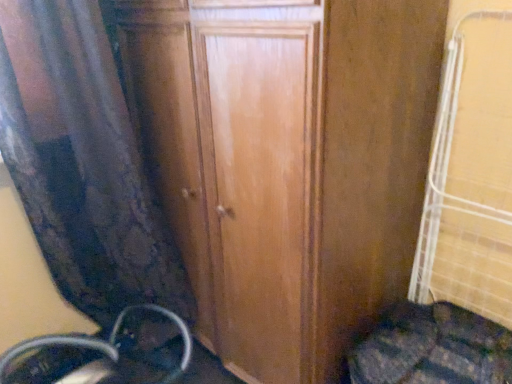
Identify the location of wooden door at center. (287, 162).

Measure the distance between point (426, 158) and camera.

Point (426, 158) and camera are 1.36 meters apart.

Where is `velvet curtain at left`? The height and width of the screenshot is (384, 512). velvet curtain at left is located at coordinates (82, 162).

This screenshot has width=512, height=384. In order to click on wooden door at center in this screenshot , I will do `click(287, 162)`.

Is velvet curtain at left located outside wooden door at center?

Yes.

Can you confirm if velvet curtain at left is smaller than wooden door at center?

Indeed, velvet curtain at left has a smaller size compared to wooden door at center.

Would you say velvet curtain at left is to the left or to the right of wooden door at center in the picture?

Clearly, velvet curtain at left is on the left of wooden door at center in the image.

Is wooden door at center taller than velvet curtain at left?

Correct, wooden door at center is much taller as velvet curtain at left.

Can you tell me how much wooden door at center and velvet curtain at left differ in facing direction?

The angular difference between wooden door at center and velvet curtain at left is 90.1 degrees.

Is wooden door at center next to velvet curtain at left and touching it?

wooden door at center is not next to velvet curtain at left, and they're not touching.

Would you say wooden door at center contains velvet curtain at left?

That's incorrect, velvet curtain at left is not inside wooden door at center.

Is velvet curtain at left in front of or behind metallic silver wheel at lower left in the image?

In the image, velvet curtain at left appears in front of metallic silver wheel at lower left.

From a real-world perspective, who is located higher, velvet curtain at left or metallic silver wheel at lower left?

velvet curtain at left is physically above.

Based on the photo, can you confirm if velvet curtain at left is taller than metallic silver wheel at lower left?

Indeed, velvet curtain at left has a greater height compared to metallic silver wheel at lower left.

Is there a large distance between velvet curtain at left and metallic silver wheel at lower left?

velvet curtain at left is near metallic silver wheel at lower left, not far away.

Identify the location of door on the right side of metallic silver wheel at lower left. This screenshot has height=384, width=512. (287, 162).

Is metallic silver wheel at lower left turned away from wooden door at center?

metallic silver wheel at lower left does not have its back to wooden door at center.

Consider the image. Is metallic silver wheel at lower left taller than wooden door at center?

Incorrect, the height of metallic silver wheel at lower left is not larger of that of wooden door at center.

Considering the relative positions of metallic silver wheel at lower left and wooden door at center in the image provided, is metallic silver wheel at lower left to the left of wooden door at center from the viewer's perspective?

Yes.

From the picture: Would you consider wooden door at center to be distant from metallic silver wheel at lower left?

No, wooden door at center is in close proximity to metallic silver wheel at lower left.

Is wooden door at center shorter than metallic silver wheel at lower left?

In fact, wooden door at center may be taller than metallic silver wheel at lower left.

Which is in front, point (160, 38) or point (0, 375)?

The point (160, 38) is closer.

Image resolution: width=512 pixels, height=384 pixels. I want to click on wheel behind the velvet curtain at left, so click(104, 343).

Is metallic silver wheel at lower left smaller than velvet curtain at left?

Indeed, metallic silver wheel at lower left has a smaller size compared to velvet curtain at left.

How distant is metallic silver wheel at lower left from velvet curtain at left?

They are 18.26 inches apart.

Considering their positions, is metallic silver wheel at lower left located in front of or behind velvet curtain at left?

metallic silver wheel at lower left is positioned farther from the viewer than velvet curtain at left.

At what (x,y) coordinates should I click in order to perform the action: click on curtain that appears on the left of wooden door at center. Please return your answer as a coordinate pair (x, y). The image size is (512, 384). Looking at the image, I should click on click(82, 162).

Where is `curtain positioned vertically above the wooden door at center (from a real-world perspective)`? The width and height of the screenshot is (512, 384). curtain positioned vertically above the wooden door at center (from a real-world perspective) is located at coordinates (82, 162).

Which object lies nearer to the anchor point velvet curtain at left, metallic silver wheel at lower left or wooden door at center?

wooden door at center lies closer to velvet curtain at left than the other object.

Considering their positions, is wooden door at center positioned closer to velvet curtain at left than metallic silver wheel at lower left?

Among the two, wooden door at center is located nearer to velvet curtain at left.

When comparing their distances from metallic silver wheel at lower left, does wooden door at center or velvet curtain at left seem closer?

velvet curtain at left lies closer to metallic silver wheel at lower left than the other object.

Based on the photo, considering their positions, is metallic silver wheel at lower left positioned further to wooden door at center than velvet curtain at left?

metallic silver wheel at lower left lies further to wooden door at center than the other object.

From the image, which object appears to be farther from metallic silver wheel at lower left, velvet curtain at left or wooden door at center?

wooden door at center is further to metallic silver wheel at lower left.

Which object lies nearer to the anchor point wooden door at center, velvet curtain at left or metallic silver wheel at lower left?

The object closer to wooden door at center is velvet curtain at left.

This screenshot has width=512, height=384. In order to click on curtain situated between metallic silver wheel at lower left and wooden door at center from left to right in this screenshot , I will do `click(82, 162)`.